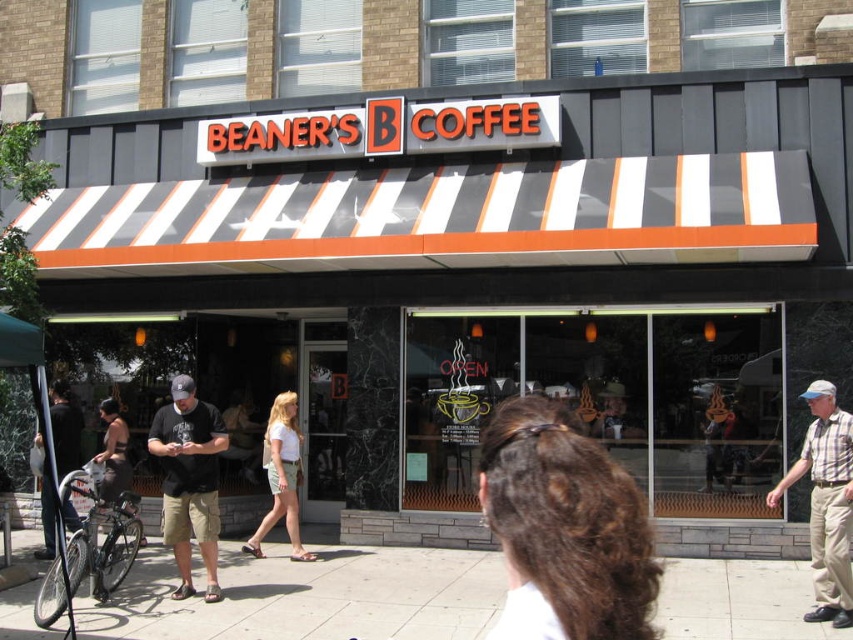
You are a photographer taking a portrait of the man in front of Beaner Coffee. The man has dark brown hair at center and is wearing a dark brown leather jacket at center. Which part of him would appear narrower in the photo?

The dark brown hair at center appears narrower than the dark brown leather jacket at center in the photo.

You are a photographer standing in front of Beaner Coffee. You want to take a photo of the dark brown hair at center and dark brown leather jacket at center so that both are fully visible. Based on their heights, which object should you focus on to ensure both are in frame?

You should focus on the dark brown leather jacket at center since it is taller than the dark brown hair at center, ensuring both are visible in the frame.